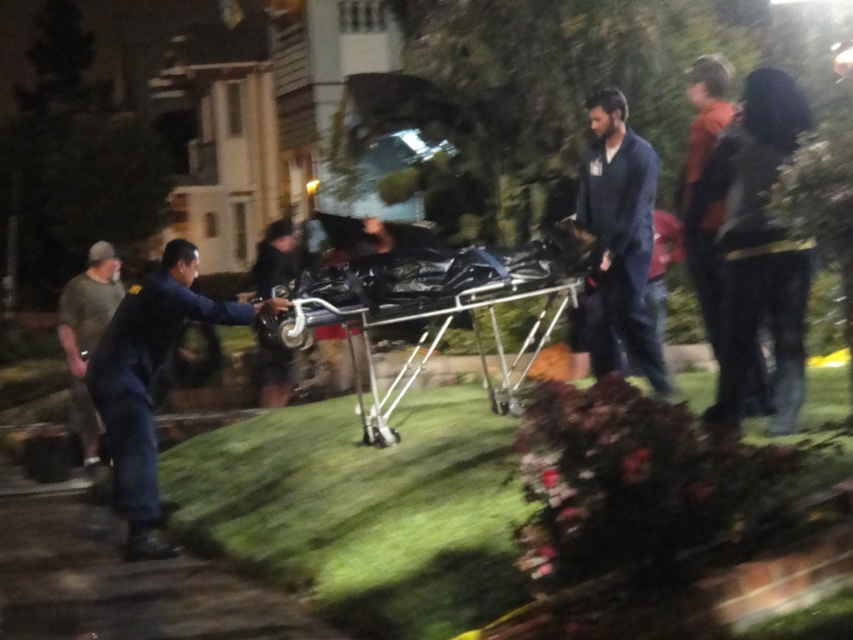
Is point (656, 365) closer to viewer compared to point (527, 273)?

Yes, point (656, 365) is closer to viewer.

Is point (651, 212) closer to viewer compared to point (451, 310)?

No, (651, 212) is behind (451, 310).

I want to click on blue fabric shirt at center, so click(619, 237).

Can you confirm if dark blue uniform at left is positioned to the right of metallic silver cart at center?

Incorrect, dark blue uniform at left is not on the right side of metallic silver cart at center.

Can you confirm if dark blue uniform at left is positioned below metallic silver cart at center?

Yes.

Does point (242, 317) come in front of point (479, 362)?

Yes, it is.

The width and height of the screenshot is (853, 640). Identify the location of dark blue uniform at left. (149, 381).

Between metallic silver cart at center and green cotton t-shirt at left, which one appears on the left side from the viewer's perspective?

From the viewer's perspective, green cotton t-shirt at left appears more on the left side.

Between point (503, 360) and point (111, 314), which one is positioned in front?

Positioned in front is point (111, 314).

Who is more forward, (x=495, y=328) or (x=64, y=285)?

Point (x=495, y=328) is in front.

I want to click on metallic silver cart at center, so click(x=433, y=337).